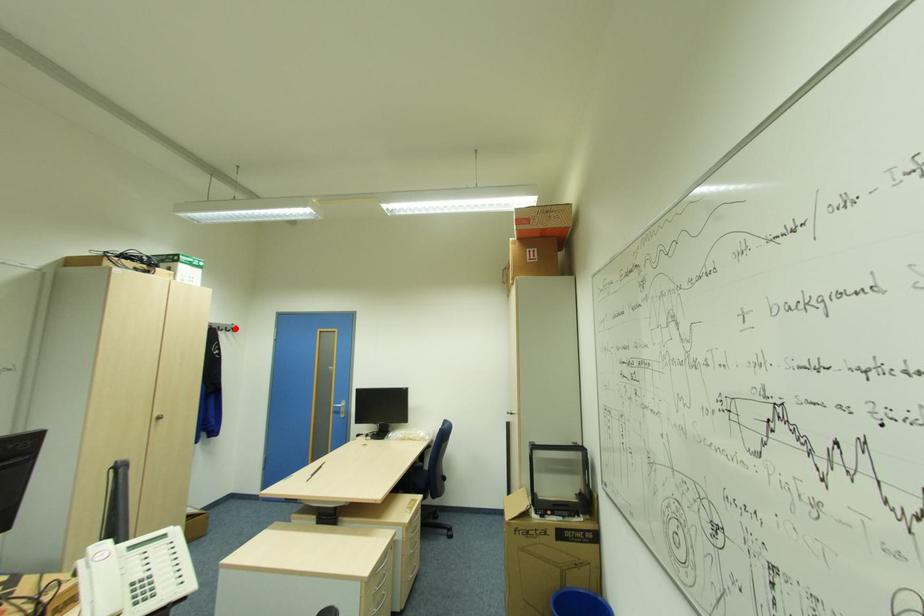
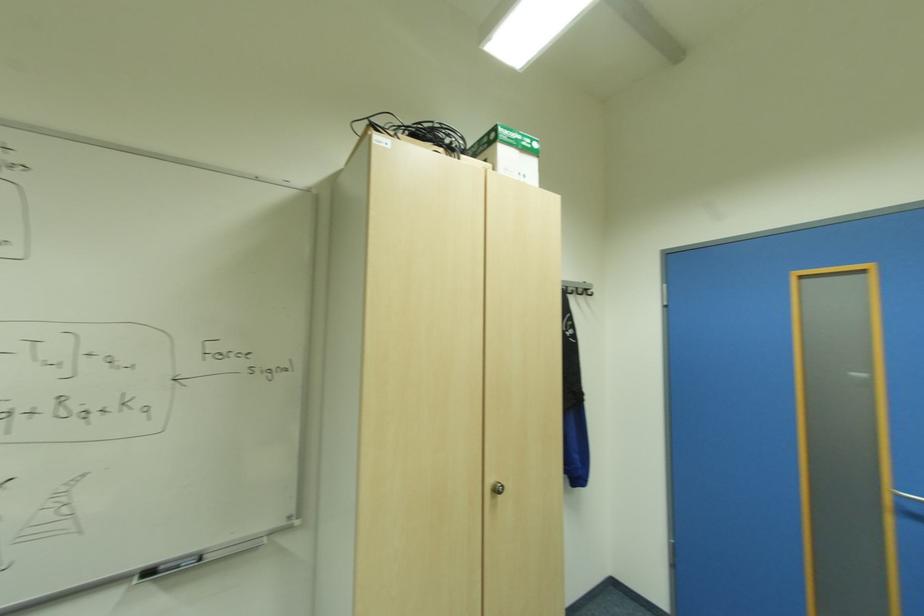
Locate, in the second image, the point that corresponds to the highlighted location in the first image.

(588, 291)